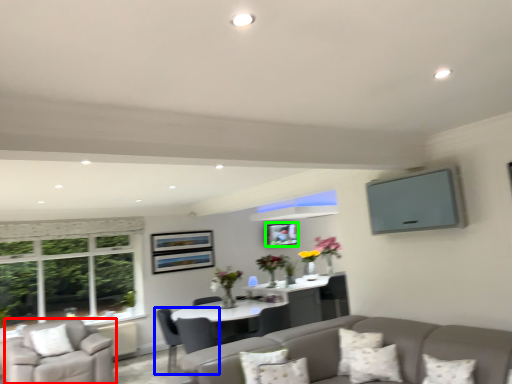
Question: Which is nearer to the chair (highlighted by a red box)? chair (highlighted by a blue box) or picture frame (highlighted by a green box).

Choices:
 (A) chair
 (B) picture frame

Answer: (A)